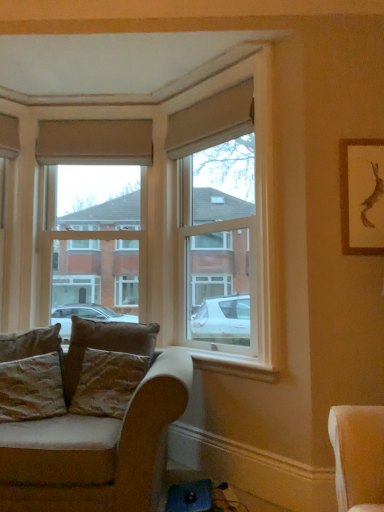
Question: Is white painted wood at lower right bigger or smaller than beige fabric curtain at upper center, arranged as the second curtain when viewed from the right?

Choices:
 (A) small
 (B) big

Answer: (A)

Question: Would you say white painted wood at lower right is inside or outside beige fabric curtain at upper center, arranged as the second curtain when viewed from the right?

Choices:
 (A) inside
 (B) outside

Answer: (B)

Question: Estimate the real-world distances between objects in this image. Which object is closer to the wooden framed artwork at upper right?

Choices:
 (A) beige fabric curtain at upper center, the 2th curtain in the front-to-back sequence
 (B) clear glass window at center, the 1th window from the left
 (C) clear glass window at center, which appears as the second window when viewed from the left
 (D) velvet beige couch at lower left
 (E) velvet brown pillow at lower left, the 1th pillow from the right

Answer: (C)

Question: Which is farther from the clear glass window at center, the 1th window from the left?

Choices:
 (A) wooden framed artwork at upper right
 (B) beige fabric curtain at upper center, the 2th curtain in the front-to-back sequence
 (C) white painted wood at lower right
 (D) brown velvety pillow at lower left, which appears as the second pillow when viewed from the right
 (E) textured beige pillow at lower left, which is the first pillow from left to right

Answer: (A)